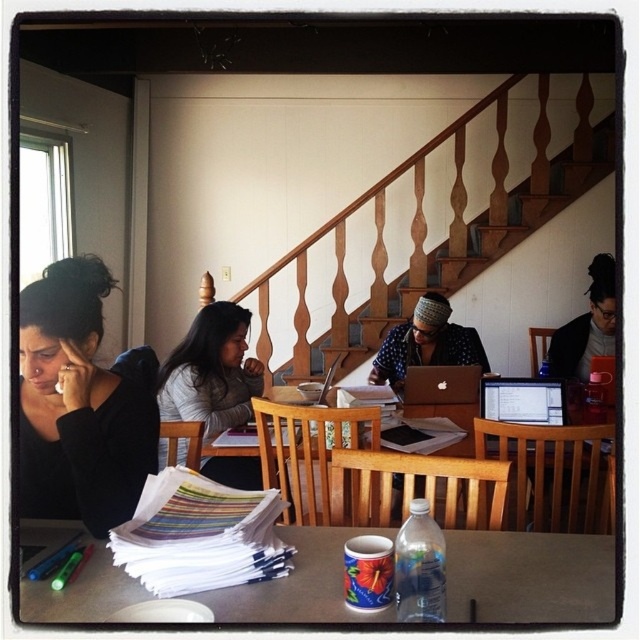
Between wooden table at center and wooden stairs at upper center, which one appears on the left side from the viewer's perspective?

Positioned to the left is wooden table at center.

What do you see at coordinates (442, 472) in the screenshot? Image resolution: width=640 pixels, height=640 pixels. I see `wooden table at center` at bounding box center [442, 472].

Describe the element at coordinates (442, 472) in the screenshot. I see `wooden table at center` at that location.

Locate an element on the screen. The image size is (640, 640). wooden table at center is located at coordinates (442, 472).

What do you see at coordinates (81, 403) in the screenshot? I see `black matte shirt at left` at bounding box center [81, 403].

Between black matte shirt at left and polka dot shirt at center, which one appears on the right side from the viewer's perspective?

polka dot shirt at center is more to the right.

Identify the location of black matte shirt at left. (81, 403).

Which of these two, wooden table at center or matte gray sweater at center, stands taller?

With more height is matte gray sweater at center.

Who is shorter, wooden table at center or matte gray sweater at center?

With less height is wooden table at center.

What do you see at coordinates (442, 472) in the screenshot? Image resolution: width=640 pixels, height=640 pixels. I see `wooden table at center` at bounding box center [442, 472].

Identify the location of wooden table at center. (442, 472).